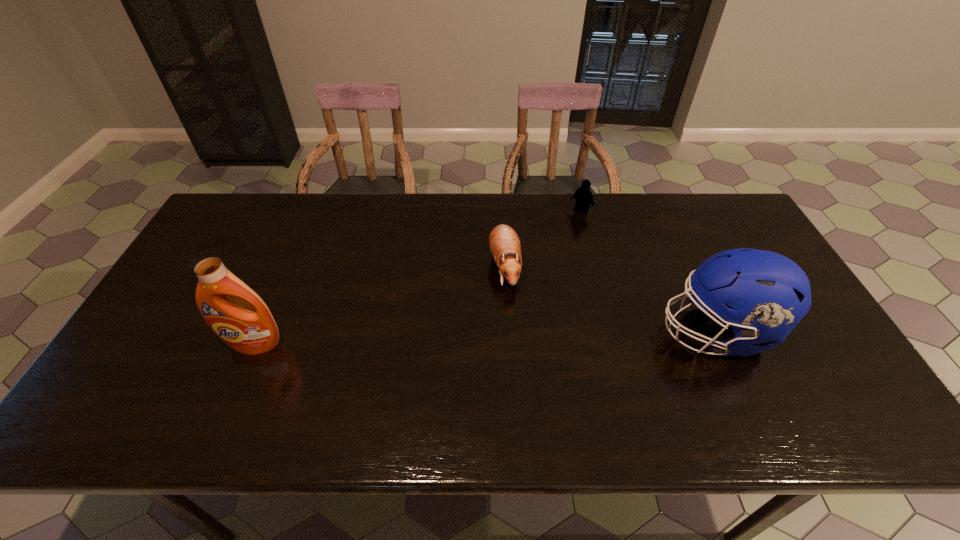
The image size is (960, 540). What are the coordinates of `free space on the desktop that is between the leftmost object and the rightmost object and is positioned on the face of the second object from right to left` in the screenshot? It's located at (466, 339).

Where is `vacant space on the desktop that is between the leftmost object and the second tallest object and is positioned at the face of the hamster`? Image resolution: width=960 pixels, height=540 pixels. vacant space on the desktop that is between the leftmost object and the second tallest object and is positioned at the face of the hamster is located at coordinates coord(509,337).